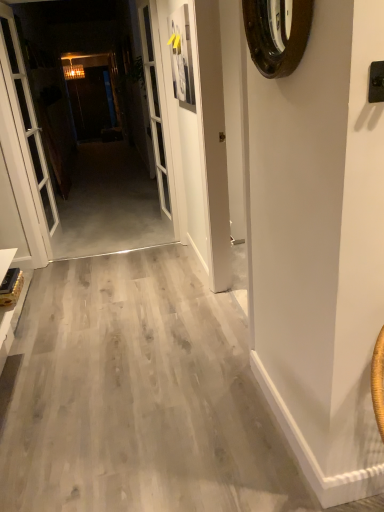
Question: Does white glass door at left contain concrete floor at center?

Choices:
 (A) yes
 (B) no

Answer: (B)

Question: Does white glass door at left have a lesser width compared to concrete floor at center?

Choices:
 (A) no
 (B) yes

Answer: (A)

Question: Can we say white glass door at left lies outside concrete floor at center?

Choices:
 (A) no
 (B) yes

Answer: (B)

Question: Considering the relative sizes of white glass door at left and concrete floor at center in the image provided, is white glass door at left bigger than concrete floor at center?

Choices:
 (A) yes
 (B) no

Answer: (B)

Question: Can you confirm if white glass door at left is positioned to the right of concrete floor at center?

Choices:
 (A) no
 (B) yes

Answer: (A)

Question: Considering the relative sizes of white glass door at left and concrete floor at center in the image provided, is white glass door at left taller than concrete floor at center?

Choices:
 (A) no
 (B) yes

Answer: (B)

Question: Considering the relative positions of concrete floor at center and white glass screen door at center in the image provided, is concrete floor at center in front of white glass screen door at center?

Choices:
 (A) no
 (B) yes

Answer: (B)

Question: Considering the relative sizes of concrete floor at center and white glass screen door at center in the image provided, is concrete floor at center shorter than white glass screen door at center?

Choices:
 (A) no
 (B) yes

Answer: (B)

Question: Does concrete floor at center touch white glass screen door at center?

Choices:
 (A) yes
 (B) no

Answer: (B)

Question: Considering the relative sizes of concrete floor at center and white glass screen door at center in the image provided, is concrete floor at center taller than white glass screen door at center?

Choices:
 (A) no
 (B) yes

Answer: (A)

Question: Does concrete floor at center have a lesser width compared to white glass screen door at center?

Choices:
 (A) no
 (B) yes

Answer: (B)

Question: Are concrete floor at center and white glass screen door at center far apart?

Choices:
 (A) no
 (B) yes

Answer: (B)

Question: Is white glass screen door at center closer to the viewer compared to brown wooden clock at upper right?

Choices:
 (A) no
 (B) yes

Answer: (A)